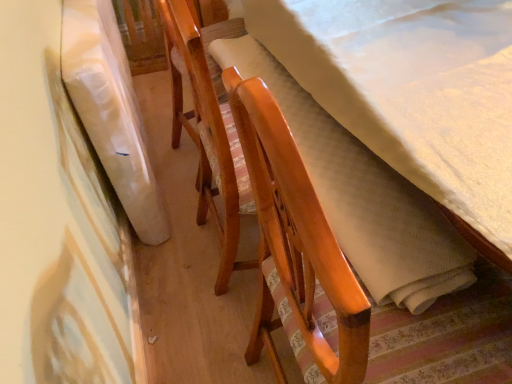
In order to click on white fabric at left in this screenshot , I will do point(111,111).

What do you see at coordinates (111, 111) in the screenshot? Image resolution: width=512 pixels, height=384 pixels. I see `white fabric at left` at bounding box center [111, 111].

What do you see at coordinates (338, 231) in the screenshot? I see `wooden chair with striped cushion at center` at bounding box center [338, 231].

Image resolution: width=512 pixels, height=384 pixels. What are the coordinates of `wooden chair with striped cushion at center` in the screenshot? It's located at (338, 231).

Locate an element on the screen. This screenshot has height=384, width=512. white fabric at left is located at coordinates (111, 111).

Considering the positions of objects white fabric at left and wooden chair with striped cushion at center in the image provided, who is more to the right, white fabric at left or wooden chair with striped cushion at center?

Positioned to the right is wooden chair with striped cushion at center.

Which is behind, white fabric at left or wooden chair with striped cushion at center?

white fabric at left is behind.

Which is in front, point (158, 196) or point (233, 100)?

The point (233, 100) is closer to the camera.

From the image's perspective, would you say white fabric at left is positioned over wooden chair with striped cushion at center?

Indeed, from the image's perspective, white fabric at left is shown above wooden chair with striped cushion at center.

From a real-world perspective, is white fabric at left located beneath wooden chair with striped cushion at center?

Correct, in the physical world, white fabric at left is lower than wooden chair with striped cushion at center.

Is white fabric at left wider than wooden chair with striped cushion at center?

No.

Does white fabric at left have a lesser height compared to wooden chair with striped cushion at center?

Yes, white fabric at left is shorter than wooden chair with striped cushion at center.

Considering the relative sizes of white fabric at left and wooden chair with striped cushion at center in the image provided, is white fabric at left bigger than wooden chair with striped cushion at center?

Actually, white fabric at left might be smaller than wooden chair with striped cushion at center.

Choose the correct answer: Is white fabric at left inside wooden chair with striped cushion at center or outside it?

white fabric at left is not inside wooden chair with striped cushion at center, it's outside.

Is white fabric at left far away from wooden chair with striped cushion at center?

They are positioned close to each other.

Is wooden chair with striped cushion at center at the back of white fabric at left?

white fabric at left is not turned away from wooden chair with striped cushion at center.

I want to click on blanket above the wooden chair with striped cushion at center (from the image's perspective), so click(x=111, y=111).

In the image, is wooden chair with striped cushion at center on the left side or the right side of white fabric at left?

From the image, it's evident that wooden chair with striped cushion at center is to the right of white fabric at left.

Considering their positions, is wooden chair with striped cushion at center located in front of or behind white fabric at left?

Visually, wooden chair with striped cushion at center is located in front of white fabric at left.

Is point (323, 125) positioned before point (149, 213)?

Yes, it is.

From the image's perspective, between wooden chair with striped cushion at center and white fabric at left, who is located below?

wooden chair with striped cushion at center is shown below in the image.

From a real-world perspective, is wooden chair with striped cushion at center located beneath white fabric at left?

No, from a real-world perspective, wooden chair with striped cushion at center is not under white fabric at left.

Is wooden chair with striped cushion at center thinner than white fabric at left?

No.

Consider the image. Which of these two, wooden chair with striped cushion at center or white fabric at left, stands taller?

Standing taller between the two is wooden chair with striped cushion at center.

Looking at this image, is wooden chair with striped cushion at center bigger than white fabric at left?

Indeed, wooden chair with striped cushion at center has a larger size compared to white fabric at left.

Is wooden chair with striped cushion at center situated inside white fabric at left or outside?

The correct answer is: outside.

Is wooden chair with striped cushion at center not near white fabric at left?

That's not correct — wooden chair with striped cushion at center is a little close to white fabric at left.

Does wooden chair with striped cushion at center turn towards white fabric at left?

No, wooden chair with striped cushion at center does not turn towards white fabric at left.

The width and height of the screenshot is (512, 384). Find the location of `furniture in front of the white fabric at left`. furniture in front of the white fabric at left is located at coordinates (338, 231).

Find the location of a particular element. The height and width of the screenshot is (384, 512). blanket that appears above the wooden chair with striped cushion at center (from the image's perspective) is located at coordinates coord(111,111).

Identify the location of blanket on the left of wooden chair with striped cushion at center. Image resolution: width=512 pixels, height=384 pixels. pos(111,111).